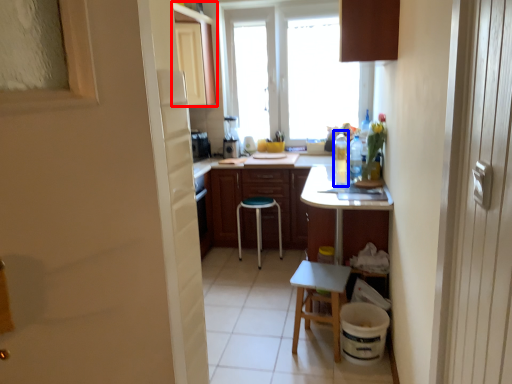
Question: Which point is closer to the camera, cabinetry (highlighted by a red box) or bottle (highlighted by a blue box)?

Choices:
 (A) cabinetry
 (B) bottle

Answer: (B)